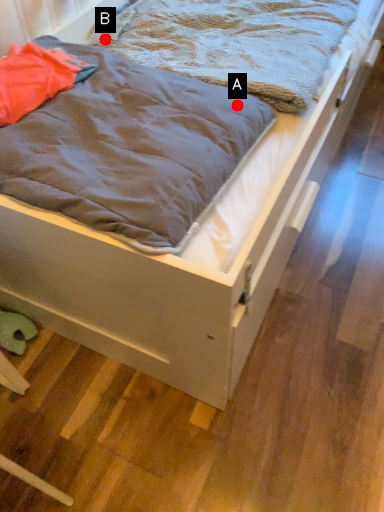
Question: Two points are circled on the image, labeled by A and B beside each circle. Which point is closer to the camera taking this photo?

Choices:
 (A) A is closer
 (B) B is closer

Answer: (A)